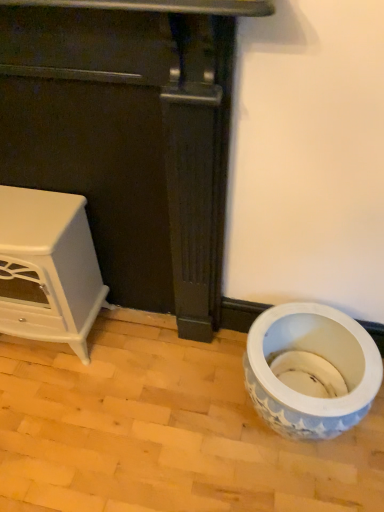
Question: Is white glossy stove at left, which ranks as the 2th furniture in left-to-right order, wider or thinner than blue and white ceramic vase at lower right?

Choices:
 (A) wide
 (B) thin

Answer: (B)

Question: Is point (72, 74) positioned closer to the camera than point (288, 399)?

Choices:
 (A) farther
 (B) closer

Answer: (B)

Question: Which of these objects is positioned farthest from the blue and white ceramic vase at lower right?

Choices:
 (A) white glossy cabinet at left, the 2th furniture when ordered from right to left
 (B) white glossy stove at left, the first furniture viewed from the right

Answer: (A)

Question: Based on their relative distances, which object is farther from the blue and white ceramic vase at lower right?

Choices:
 (A) white glossy stove at left, which ranks as the 2th furniture in left-to-right order
 (B) white glossy cabinet at left, the 2th furniture when ordered from right to left

Answer: (B)